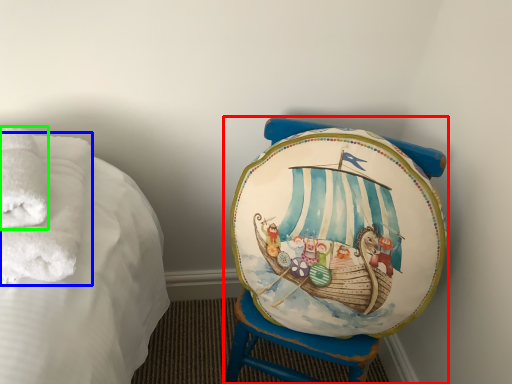
Question: Based on their relative distances, which object is nearer to furniture (highlighted by a red box)? Choose from bath towel (highlighted by a blue box) and bath towel (highlighted by a green box).

Choices:
 (A) bath towel
 (B) bath towel

Answer: (A)